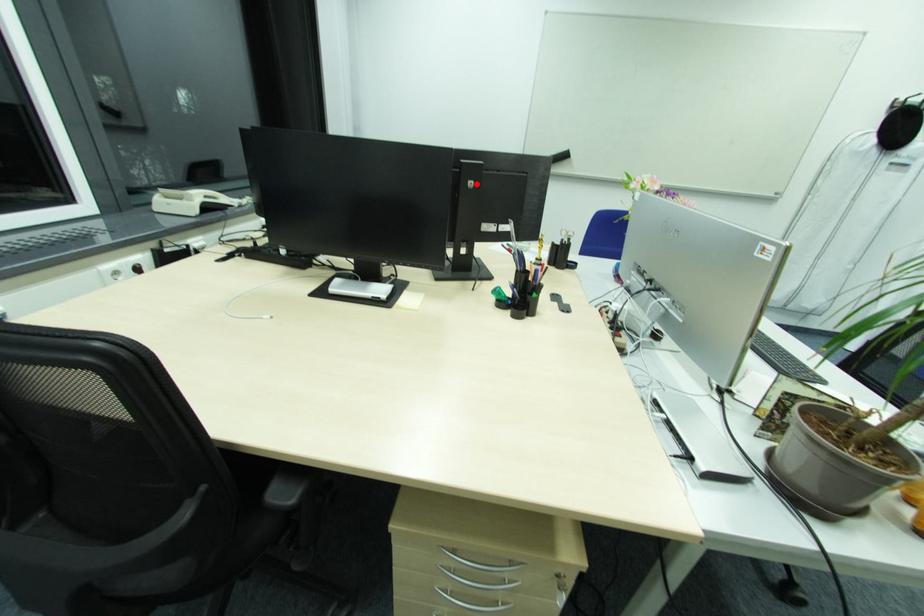
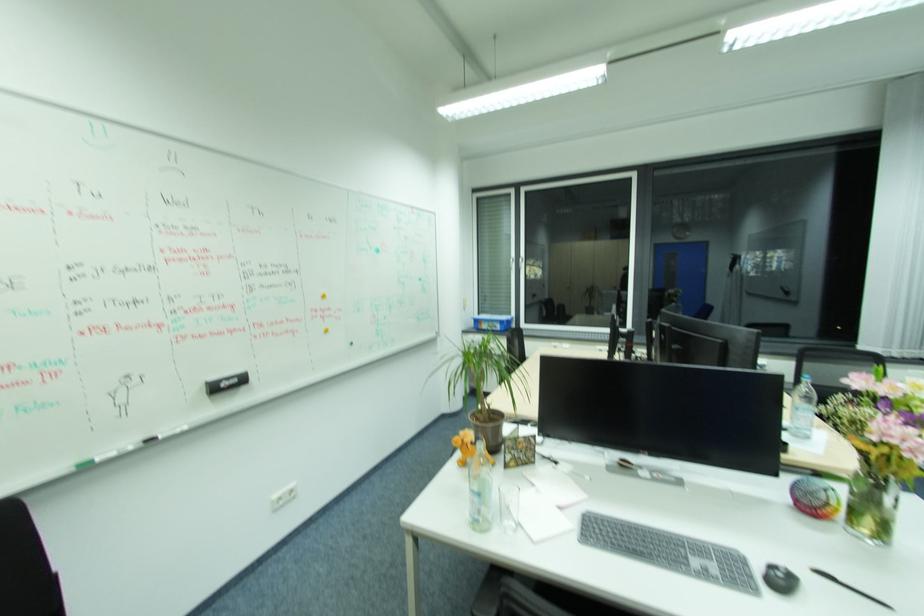
In the second image, find the point that corresponds to the highlighted location in the first image.

(666, 334)